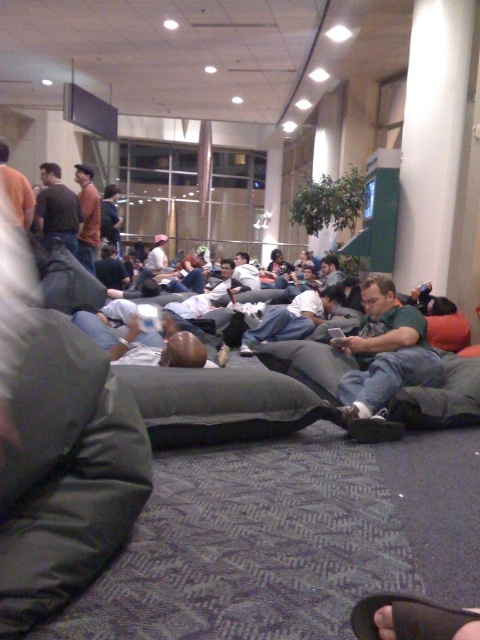
Question: Observing the image, what is the correct spatial positioning of green cotton shirt at center in reference to dark brown leather jacket at center?

Choices:
 (A) below
 (B) above

Answer: (A)

Question: Which object appears closest to the camera in this image?

Choices:
 (A) white cotton shirt at center
 (B) orange sweater at center
 (C) light gray fabric couch at center

Answer: (C)

Question: Estimate the real-world distances between objects in this image. Which object is closer to the orange sweater at center?

Choices:
 (A) denim jeans at center
 (B) light gray fabric couch at center

Answer: (B)

Question: Considering the real-world distances, which object is closest to the denim jeans at center?

Choices:
 (A) light gray fabric couch at center
 (B) orange sweater at center
 (C) green cotton shirt at center
 (D) dark brown leather jacket at center

Answer: (A)

Question: Does orange sweater at center appear over light gray fabric couch at center?

Choices:
 (A) yes
 (B) no

Answer: (A)

Question: Can you confirm if green cotton shirt at center is positioned below white cotton shirt at center?

Choices:
 (A) no
 (B) yes

Answer: (B)